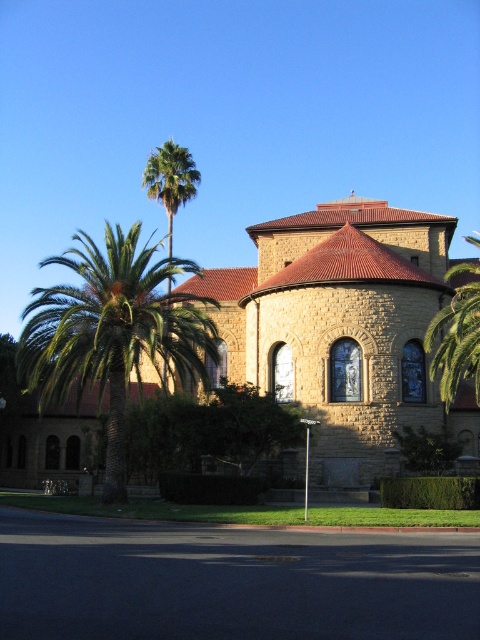
Question: Does brown stone church at center appear over green leafy palm at left?

Choices:
 (A) no
 (B) yes

Answer: (A)

Question: Which point is closer to the camera taking this photo?

Choices:
 (A) (435, 362)
 (B) (80, 364)
 (C) (347, 396)

Answer: (B)

Question: Which of the following is the closest to the observer?

Choices:
 (A) (38, 358)
 (B) (479, 246)
 (C) (159, 193)
 (D) (474, 449)

Answer: (A)

Question: From the image, what is the correct spatial relationship of green leafy palm tree at right in relation to green leafy palm at upper left?

Choices:
 (A) below
 (B) above

Answer: (A)

Question: Can you confirm if green leafy palm at left is positioned to the left of green leafy palm tree at right?

Choices:
 (A) yes
 (B) no

Answer: (A)

Question: Among these points, which one is nearest to the camera?

Choices:
 (A) tap(148, 177)
 (B) tap(442, 392)
 (C) tap(365, 237)

Answer: (B)